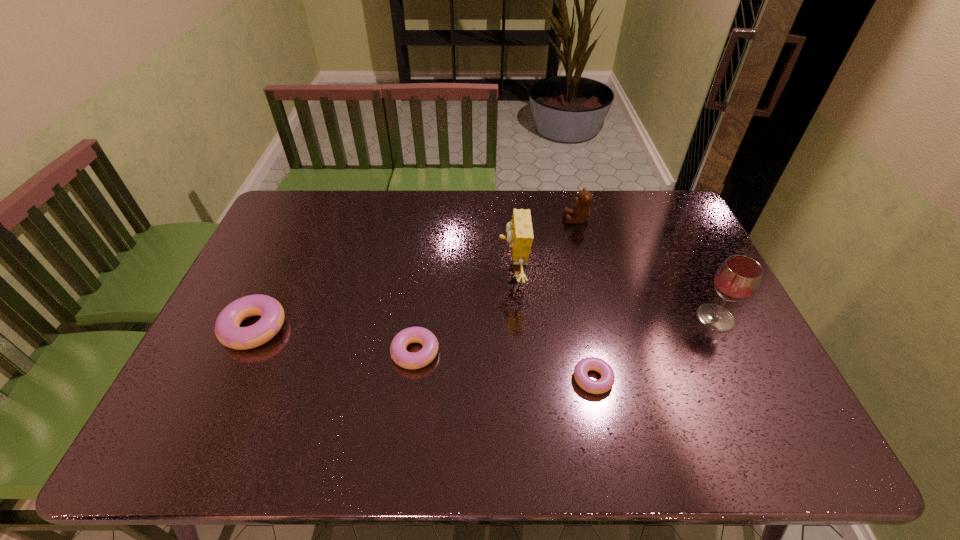
You are a GUI agent. You are given a task and a screenshot of the screen. Output one action in this format:
    pyautogui.click(x=<x>, y=<y>)
    Task: Click on the free space between the farthest object and the leftmost doughnut
    Image resolution: width=960 pixels, height=540 pixels.
    Given the screenshot: What is the action you would take?
    pyautogui.click(x=416, y=274)

Identify the location of vacant point located between the wineglass and the second object from left to right. (565, 335).

Locate an element on the screen. free spot between the rightmost object and the farthest object is located at coordinates (646, 268).

Identify the location of vacant space that is in between the rightmost object and the fourth tallest object. The image size is (960, 540). (485, 323).

Locate an element on the screen. This screenshot has width=960, height=540. free space that is in between the second shortest object and the teddy bear is located at coordinates (495, 286).

At what (x,y) coordinates should I click in order to perform the action: click on vacant space that's between the second shortest object and the wineglass. Please return your answer as a coordinate pair (x, y). Looking at the image, I should click on (565, 335).

Find the location of `vacant space in between the tallest doughnut and the second doughnut from left to right`. vacant space in between the tallest doughnut and the second doughnut from left to right is located at coordinates (335, 340).

Find the location of a particular element. vacant point located between the shortest object and the sponge is located at coordinates (553, 327).

You are a GUI agent. You are given a task and a screenshot of the screen. Output one action in this format:
    pyautogui.click(x=<x>, y=<y>)
    Task: Click on the empty space between the farthest object and the sponge
    This screenshot has width=960, height=540.
    Given the screenshot: What is the action you would take?
    pyautogui.click(x=544, y=247)

Image resolution: width=960 pixels, height=540 pixels. Identify the location of unoccupied position between the third object from left to right and the shortest doughnut. (553, 327).